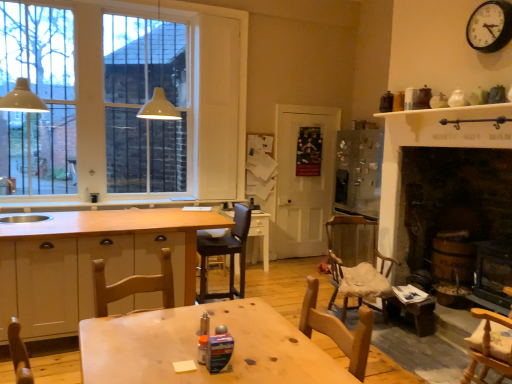
What is the approximate width of white glass window at upper left?

The width of white glass window at upper left is 2.56 inches.

Describe the element at coordinates (338, 329) in the screenshot. I see `wooden chair at lower center, the first chair from the front` at that location.

Measure the distance between wooden at left and camera.

wooden at left is 13.64 feet away from camera.

What do you see at coordinates (225, 254) in the screenshot?
I see `leatherette bar stool at center, which is the 2th chair from back to front` at bounding box center [225, 254].

You are a GUI agent. You are given a task and a screenshot of the screen. Output one action in this format:
    pyautogui.click(x=<x>, y=<y>)
    Task: Click on the white glass window at upper left
    The height and width of the screenshot is (384, 512).
    Given the screenshot: What is the action you would take?
    pyautogui.click(x=123, y=100)

Is white glossy table at center, the 1th table in the back-to-front sequence, bigger or smaller than white matte door at center?

white glossy table at center, the 1th table in the back-to-front sequence, is smaller than white matte door at center.

Consider the image. Is white glossy table at center, the 2th table in the front-to-back sequence, looking in the opposite direction of white matte door at center?

No, white glossy table at center, the 2th table in the front-to-back sequence, is not facing away from white matte door at center.

How far apart are white glossy table at center, the 1th table in the back-to-front sequence, and white matte door at center?

white glossy table at center, the 1th table in the back-to-front sequence, and white matte door at center are 32.52 inches apart.

Visually, is white glossy table at center, the 2th table in the front-to-back sequence, positioned to the left or to the right of white matte door at center?

white glossy table at center, the 2th table in the front-to-back sequence, is positioned on white matte door at center's left side.

Does white glossy table at center, the 2th table in the front-to-back sequence, contain wooden at left?

That's incorrect, wooden at left is not inside white glossy table at center, the 2th table in the front-to-back sequence.

Which is closer to the camera, (231,216) or (55,210)?

Point (231,216).

Is white glossy table at center, the 2th table in the front-to-back sequence, wider than wooden at left?

Correct, the width of white glossy table at center, the 2th table in the front-to-back sequence, exceeds that of wooden at left.

Does white glossy table at center, the 1th table in the back-to-front sequence, touch wooden at left?

They are not placed beside each other.

Looking at their sizes, would you say matte white lampshade at left, acting as the 1th light fixture starting from the left, is wider or thinner than wooden chair at lower center, positioned as the 3th chair in right-to-left order?

matte white lampshade at left, acting as the 1th light fixture starting from the left, is thinner than wooden chair at lower center, positioned as the 3th chair in right-to-left order.

Which object is positioned more to the right, matte white lampshade at left, placed as the 2th light fixture when sorted from right to left, or wooden chair at lower center, positioned as the 3th chair in right-to-left order?

From the viewer's perspective, wooden chair at lower center, positioned as the 3th chair in right-to-left order, appears more on the right side.

Who is smaller, matte white lampshade at left, placed as the 2th light fixture when sorted from right to left, or wooden chair at lower center, positioned as the 3th chair in right-to-left order?

With smaller size is wooden chair at lower center, positioned as the 3th chair in right-to-left order.

Is wooden chair at lower center, which ranks as the 4th chair in back-to-front order, inside or outside of white wood cabinetry at center?

wooden chair at lower center, which ranks as the 4th chair in back-to-front order, is not enclosed by white wood cabinetry at center.

Which of these two, wooden chair at lower center, the second chair when ordered from left to right, or white wood cabinetry at center, is thinner?

wooden chair at lower center, the second chair when ordered from left to right.

Starting from the white wood cabinetry at center, which chair is the 2nd one to the right? Please provide its 2D coordinates.

[(338, 329)]

Who is smaller, wooden chair at lower center, the first chair from the front, or white wood cabinetry at center?

wooden chair at lower center, the first chair from the front, is smaller.

Considering the relative sizes of white matte door at center and wooden chair at lower center, the first chair from the front, in the image provided, is white matte door at center shorter than wooden chair at lower center, the first chair from the front,?

Incorrect, the height of white matte door at center does not fall short of that of wooden chair at lower center, the first chair from the front.

From the picture: Between white matte door at center and wooden chair at lower center, positioned as the 3th chair in right-to-left order, which one appears on the right side from the viewer's perspective?

white matte door at center.

From the image's perspective, is white matte door at center on top of wooden chair at lower center, the second chair when ordered from left to right?

Yes, from the image's perspective, white matte door at center is over wooden chair at lower center, the second chair when ordered from left to right.

How far apart are white matte door at center and wooden chair at lower center, which ranks as the 4th chair in back-to-front order?

white matte door at center and wooden chair at lower center, which ranks as the 4th chair in back-to-front order, are 3.49 meters apart.

Is matte white lampshade at left, placed as the 2th light fixture when sorted from right to left, turned away from yellow matte lampshade at upper left, arranged as the first light fixture when viewed from the right?

That's not correct — matte white lampshade at left, placed as the 2th light fixture when sorted from right to left, is not looking away from yellow matte lampshade at upper left, arranged as the first light fixture when viewed from the right.

Is matte white lampshade at left, acting as the 1th light fixture starting from the left, smaller than yellow matte lampshade at upper left, arranged as the first light fixture when viewed from the right?

Correct, matte white lampshade at left, acting as the 1th light fixture starting from the left, occupies less space than yellow matte lampshade at upper left, arranged as the first light fixture when viewed from the right.

Is point (30, 100) positioned behind point (153, 107)?

No, (30, 100) is closer to viewer.

Looking at this image, which object is wider, matte white lampshade at left, acting as the 1th light fixture starting from the left, or yellow matte lampshade at upper left, the second light fixture when ordered from left to right?

yellow matte lampshade at upper left, the second light fixture when ordered from left to right.

Is wooden chair at lower center, the first chair from the front, in contact with wooden chair at lower right, which is counted as the fourth chair, starting from the left?

There is a gap between wooden chair at lower center, the first chair from the front, and wooden chair at lower right, which is counted as the fourth chair, starting from the left.

Consider the image. Considering the positions of objects wooden chair at lower center, the second chair when ordered from left to right, and wooden chair at lower right, which is counted as the fourth chair, starting from the left, in the image provided, who is in front, wooden chair at lower center, the second chair when ordered from left to right, or wooden chair at lower right, which is counted as the fourth chair, starting from the left,?

wooden chair at lower center, the second chair when ordered from left to right, is in front.

In the scene shown: From a real-world perspective, which object stands above the other?

In real-world perspective, wooden chair at lower center, which ranks as the 4th chair in back-to-front order, is above.

Where is `glass door located above the white glossy table at center, the 1th table in the back-to-front sequence (from a real-world perspective)`? The image size is (512, 384). glass door located above the white glossy table at center, the 1th table in the back-to-front sequence (from a real-world perspective) is located at coordinates (303, 180).

The image size is (512, 384). I want to click on window sill on the left side of white glossy table at center, the 1th table in the back-to-front sequence, so click(x=99, y=205).

When comparing their distances from wooden chair at lower center, the second chair when ordered from left to right, does white glossy table at center, the 1th table in the back-to-front sequence, or leatherette bar stool at center, acting as the 4th chair starting from the right, seem closer?

leatherette bar stool at center, acting as the 4th chair starting from the right.

Based on their spatial positions, is matte white lampshade at left, placed as the 2th light fixture when sorted from right to left, or white wood cabinetry at center closer to leatherette bar stool at center, which is the 2th chair from back to front?

white wood cabinetry at center.

Looking at the image, which one is located closer to white glass window at upper left, white wood cabinetry at center or white matte door at center?

white matte door at center is positioned closer to the anchor white glass window at upper left.

Estimate the real-world distances between objects in this image. Which object is closer to white matte door at center, wooden chair at lower right, acting as the second chair starting from the front, or white glass window at upper left?

Based on the image, white glass window at upper left appears to be nearer to white matte door at center.

Estimate the real-world distances between objects in this image. Which object is further from wooden chair at lower right, which is counted as the fourth chair, starting from the left, yellow matte lampshade at upper left, the second light fixture when ordered from left to right, or white wood cabinetry at center?

Among the two, yellow matte lampshade at upper left, the second light fixture when ordered from left to right, is located further to wooden chair at lower right, which is counted as the fourth chair, starting from the left.

Based on their spatial positions, is matte white lampshade at left, acting as the 1th light fixture starting from the left, or wooden chair at lower center, which ranks as the 4th chair in back-to-front order, closer to black metallic clock at upper right?

wooden chair at lower center, which ranks as the 4th chair in back-to-front order, is positioned closer to the anchor black metallic clock at upper right.

Considering their positions, is leatherette bar stool at center, which is the 2th chair from back to front, positioned further to white glossy table at center, the 1th table in the back-to-front sequence, than black metallic clock at upper right?

black metallic clock at upper right is further to white glossy table at center, the 1th table in the back-to-front sequence.

Which object lies further to the anchor point black metallic clock at upper right, yellow matte lampshade at upper left, the second light fixture when ordered from left to right, or wooden chair at lower center, the first chair from the front?

Among the two, yellow matte lampshade at upper left, the second light fixture when ordered from left to right, is located further to black metallic clock at upper right.

I want to click on light fixture between matte white lampshade at left, acting as the 1th light fixture starting from the left, and white glossy table at center, the 2th table in the front-to-back sequence, along the z-axis, so click(159, 108).

Where is `clock between wooden table at center, which is the 1th table in front-to-back order, and wooden chair with cushion at center-right, arranged as the 1th chair when viewed from the back, in the front-back direction`? The image size is (512, 384). clock between wooden table at center, which is the 1th table in front-to-back order, and wooden chair with cushion at center-right, arranged as the 1th chair when viewed from the back, in the front-back direction is located at coordinates (490, 26).

Identify the location of window between yellow matte lampshade at upper left, the second light fixture when ordered from left to right, and wooden at left vertically. Image resolution: width=512 pixels, height=384 pixels. (123, 100).

Find the location of a particular element. This screenshot has width=512, height=384. glass door located between matte white lampshade at left, acting as the 1th light fixture starting from the left, and black metallic clock at upper right in the left-right direction is located at coordinates (303, 180).